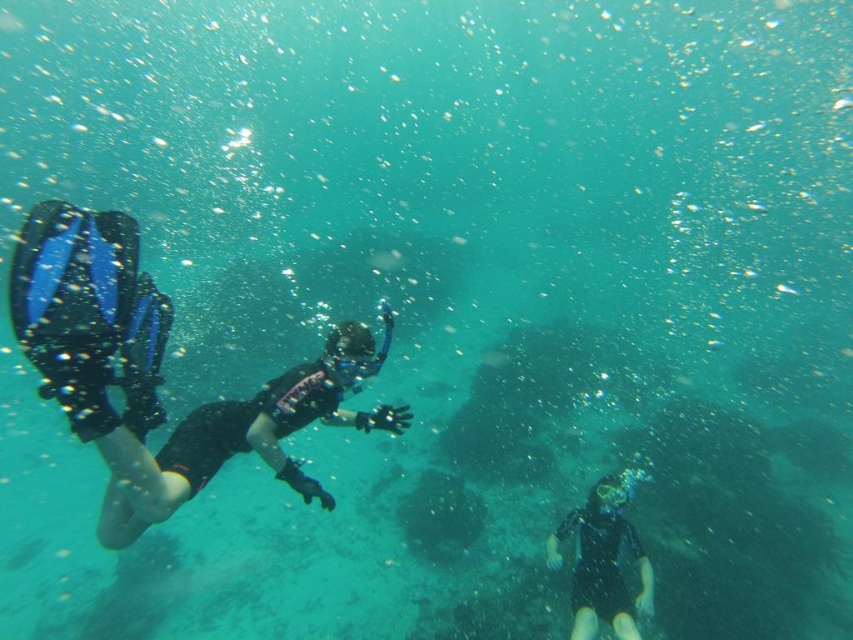
Question: Which point is farther to the camera?

Choices:
 (A) [641, 579]
 (B) [107, 508]

Answer: (A)

Question: Does black matte wetsuit at left appear on the left side of black matte wetsuit at lower right?

Choices:
 (A) yes
 (B) no

Answer: (A)

Question: Which object is farther from the camera taking this photo?

Choices:
 (A) black matte wetsuit at lower right
 (B) black matte wetsuit at left

Answer: (A)

Question: Is black matte wetsuit at left behind black matte wetsuit at lower right?

Choices:
 (A) yes
 (B) no

Answer: (B)

Question: Does black matte wetsuit at left have a greater width compared to black matte wetsuit at lower right?

Choices:
 (A) no
 (B) yes

Answer: (B)